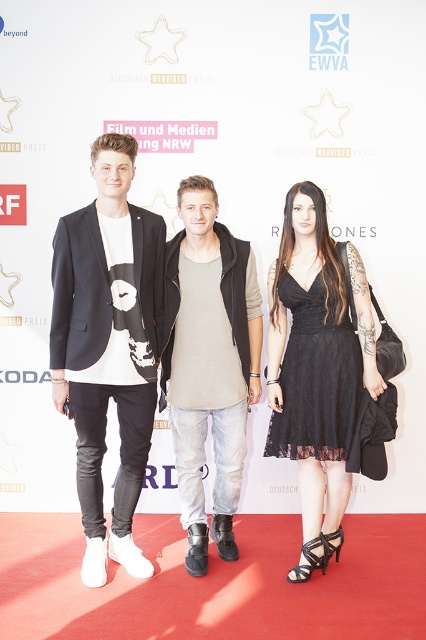
Measure the distance between matte black blazer at center and denim jeans at center.

11.70 inches

Is matte black blazer at center further to camera compared to denim jeans at center?

No, matte black blazer at center is in front of denim jeans at center.

Is point (89, 220) closer to camera compared to point (245, 385)?

That is True.

Locate an element on the screen. Image resolution: width=426 pixels, height=640 pixels. matte black blazer at center is located at coordinates (108, 346).

Who is lower down, matte black blazer at center or black lace dress at center?

Positioned lower is black lace dress at center.

Does point (74, 280) lie behind point (287, 396)?

That is False.

Locate an element on the screen. Image resolution: width=426 pixels, height=640 pixels. matte black blazer at center is located at coordinates pyautogui.click(x=108, y=346).

Is black lace dress at center in front of denim jeans at center?

That is False.

Identify the location of black lace dress at center. Image resolution: width=426 pixels, height=640 pixels. (316, 369).